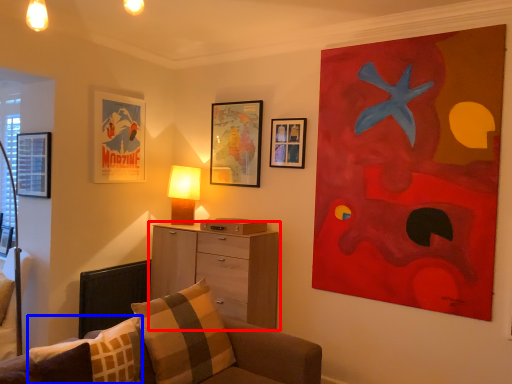
Question: Which of the following is the closest to the observer, chest of drawers (highlighted by a red box) or pillow (highlighted by a blue box)?

Choices:
 (A) chest of drawers
 (B) pillow

Answer: (B)